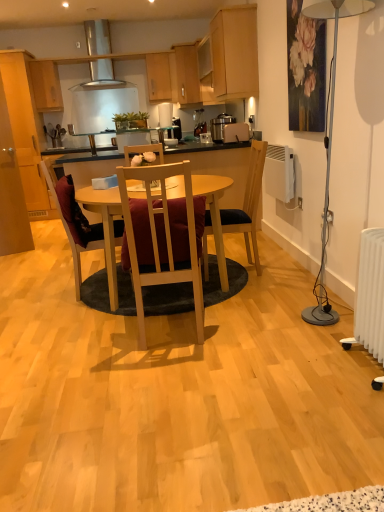
Question: From a real-world perspective, is matte wood cabinet at upper left, which is the 4th cabinetry in right-to-left order, located beneath wooden cabinet at upper center, the second cabinetry viewed from the right?

Choices:
 (A) no
 (B) yes

Answer: (A)

Question: Is matte wood cabinet at upper left, which is the 4th cabinetry in right-to-left order, to the right of wooden cabinet at upper center, which appears as the 4th cabinetry when viewed from the left, from the viewer's perspective?

Choices:
 (A) no
 (B) yes

Answer: (A)

Question: Is matte wood cabinet at upper left, which is the second cabinetry from left to right, looking in the opposite direction of wooden cabinet at upper center, the second cabinetry viewed from the right?

Choices:
 (A) no
 (B) yes

Answer: (A)

Question: Does matte wood cabinet at upper left, which is the 4th cabinetry in right-to-left order, have a larger size compared to wooden cabinet at upper center, which appears as the 4th cabinetry when viewed from the left?

Choices:
 (A) yes
 (B) no

Answer: (B)

Question: Is matte wood cabinet at upper left, which is the 4th cabinetry in right-to-left order, wider than wooden cabinet at upper center, the second cabinetry viewed from the right?

Choices:
 (A) no
 (B) yes

Answer: (B)

Question: Does matte wood cabinet at upper left, which is the 4th cabinetry in right-to-left order, have a lesser width compared to wooden cabinet at upper center, which appears as the 4th cabinetry when viewed from the left?

Choices:
 (A) no
 (B) yes

Answer: (A)

Question: From the image's perspective, is wooden cabinet at upper center, which is the 3th cabinetry from right to left, beneath matte wood cabinet at upper left, which is the 4th cabinetry in right-to-left order?

Choices:
 (A) yes
 (B) no

Answer: (B)

Question: Is wooden cabinet at upper center, which ranks as the 3th cabinetry in left-to-right order, completely or partially outside of matte wood cabinet at upper left, which is the 4th cabinetry in right-to-left order?

Choices:
 (A) no
 (B) yes

Answer: (B)

Question: Is wooden cabinet at upper center, which is the 3th cabinetry from right to left, taller than matte wood cabinet at upper left, which is the second cabinetry from left to right?

Choices:
 (A) yes
 (B) no

Answer: (A)

Question: Is wooden cabinet at upper center, which is the 3th cabinetry from right to left, far away from matte wood cabinet at upper left, which is the second cabinetry from left to right?

Choices:
 (A) no
 (B) yes

Answer: (B)

Question: Could you tell me if wooden cabinet at upper center, which is the 3th cabinetry from right to left, is turned towards matte wood cabinet at upper left, which is the second cabinetry from left to right?

Choices:
 (A) yes
 (B) no

Answer: (B)

Question: Can you confirm if wooden cabinet at upper center, which ranks as the 3th cabinetry in left-to-right order, is shorter than matte wood cabinet at upper left, which is the second cabinetry from left to right?

Choices:
 (A) yes
 (B) no

Answer: (B)

Question: From the image's perspective, would you say satin silver exhaust hood at upper center is shown under velvet maroon chair at center, which is the 3th chair in right-to-left order?

Choices:
 (A) no
 (B) yes

Answer: (A)